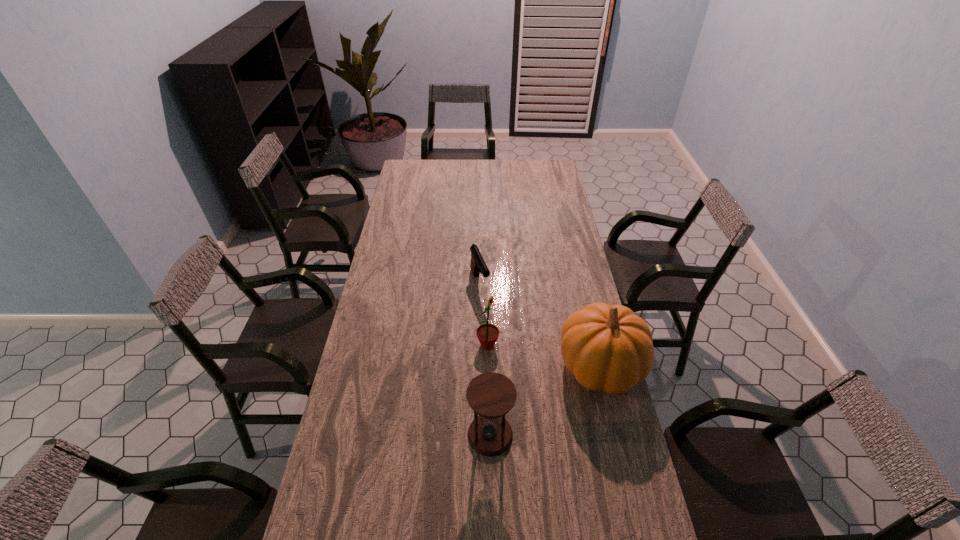
The image size is (960, 540). Find the location of `the nearest object`. the nearest object is located at coordinates (491, 395).

The height and width of the screenshot is (540, 960). I want to click on the rightmost object, so click(607, 347).

I want to click on sunflower, so (487, 334).

At what (x,y) coordinates should I click in order to perform the action: click on the shortest object. Please return your answer as a coordinate pair (x, y). Looking at the image, I should click on (478, 265).

At what (x,y) coordinates should I click in order to perform the action: click on pistol. Please return your answer as a coordinate pair (x, y). Image resolution: width=960 pixels, height=540 pixels. Looking at the image, I should click on (478, 265).

Where is `free space located on the back of the hourglass`? Image resolution: width=960 pixels, height=540 pixels. free space located on the back of the hourglass is located at coordinates (489, 324).

Locate an element on the screen. The image size is (960, 540). free space located 0.240m on the back of the pumpkin is located at coordinates (582, 288).

You are a GUI agent. You are given a task and a screenshot of the screen. Output one action in this format:
    pyautogui.click(x=<x>, y=<y>)
    Task: Click on the vacant space located on the face of the sunflower
    
    Given the screenshot: What is the action you would take?
    pyautogui.click(x=561, y=396)

You are a GUI agent. You are given a task and a screenshot of the screen. Output one action in this format:
    pyautogui.click(x=<x>, y=<y>)
    Task: Click on the free region located on the face of the sunflower
    The height and width of the screenshot is (540, 960).
    Given the screenshot: What is the action you would take?
    pyautogui.click(x=541, y=382)

Locate an element on the screen. This screenshot has height=540, width=960. free space located 0.180m on the face of the sunflower is located at coordinates (537, 379).